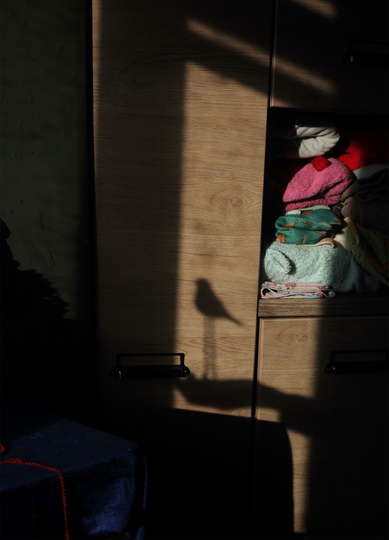
At what (x,y) coordinates should I click in order to perform the action: click on pink folded blanket. Please return your answer as a coordinate pair (x, y). Looking at the image, I should click on (306, 177).